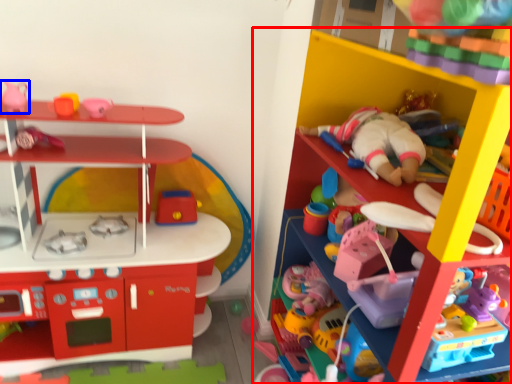
Question: Which object appears farthest to the camera in this image, shelf (highlighted by a red box) or toy (highlighted by a blue box)?

Choices:
 (A) shelf
 (B) toy

Answer: (B)